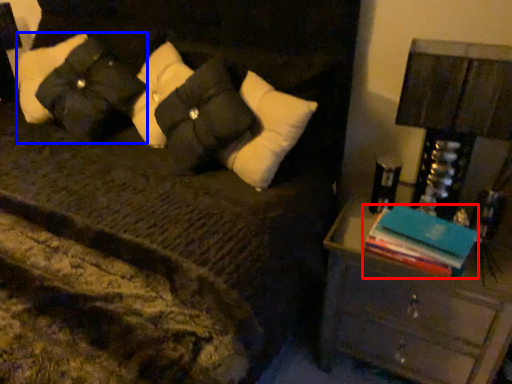
Question: Which point is further to the camera, book (highlighted by a red box) or pillow (highlighted by a blue box)?

Choices:
 (A) book
 (B) pillow

Answer: (B)